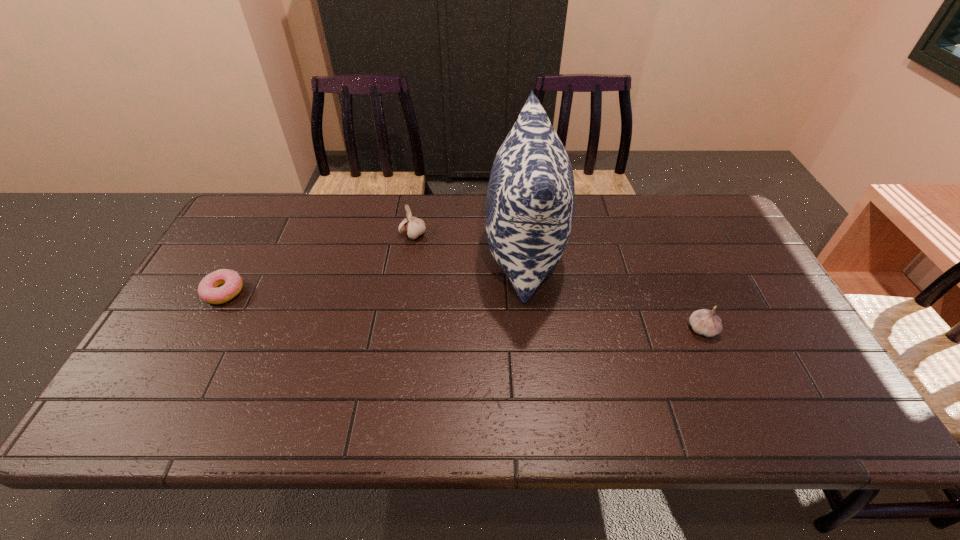
You are a GUI agent. You are given a task and a screenshot of the screen. Output one action in this format:
    pyautogui.click(x=<x>, y=<y>)
    Task: Click on the vacant space located on the front surface of the third object from left to right
    Image resolution: width=960 pixels, height=540 pixels.
    Given the screenshot: What is the action you would take?
    pyautogui.click(x=452, y=252)

Where is `free space located on the front of the left garlic`? free space located on the front of the left garlic is located at coordinates (399, 319).

The height and width of the screenshot is (540, 960). In order to click on free space located on the left of the nearer garlic in this screenshot , I will do `click(668, 329)`.

This screenshot has width=960, height=540. Find the location of `vacant space positioned 0.100m on the front of the doughnut`. vacant space positioned 0.100m on the front of the doughnut is located at coordinates (199, 338).

Locate an element on the screen. cushion that is positioned at the far edge is located at coordinates (530, 203).

Identify the location of garlic that is at the far edge. (414, 227).

Where is `object present at the left edge`? This screenshot has width=960, height=540. object present at the left edge is located at coordinates (209, 291).

This screenshot has width=960, height=540. In the image, there is a desktop. In order to click on vacant area at the far edge in this screenshot , I will do 582,208.

Where is `free spot at the near edge of the desktop`? This screenshot has height=540, width=960. free spot at the near edge of the desktop is located at coordinates (730, 422).

Identify the location of vacant space at the left edge. This screenshot has width=960, height=540. (201, 376).